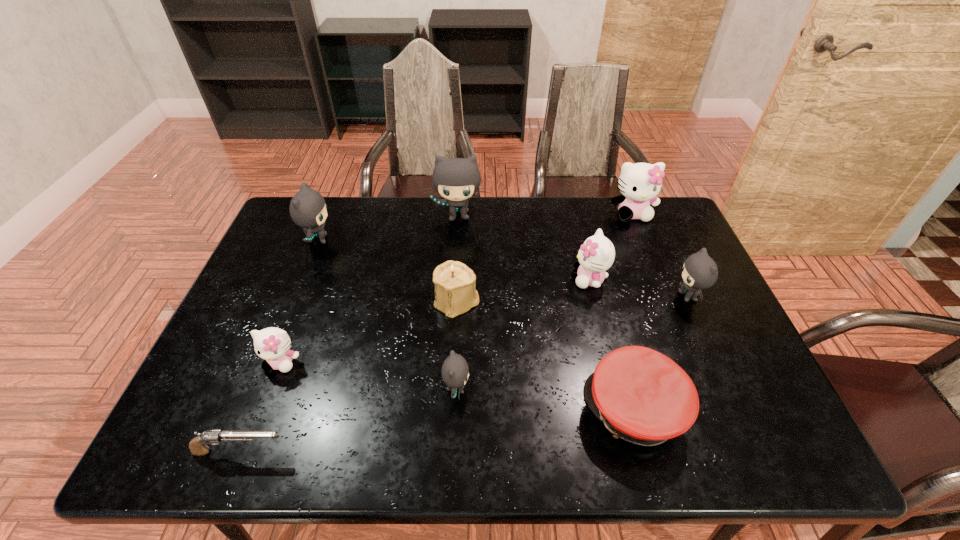
Identify the location of cap that is positioned at the near edge. (642, 396).

Image resolution: width=960 pixels, height=540 pixels. I want to click on gun situated at the near edge, so click(198, 446).

The width and height of the screenshot is (960, 540). What are the coordinates of `gun that is positioned at the left edge` in the screenshot? It's located at (198, 446).

You are a GUI agent. You are given a task and a screenshot of the screen. Output one action in this format:
    pyautogui.click(x=<x>, y=<y>)
    Task: Click on the object that is at the far left corner
    The width and height of the screenshot is (960, 540).
    Given the screenshot: What is the action you would take?
    pyautogui.click(x=308, y=209)

Find the location of a particular element. The height and width of the screenshot is (540, 960). object that is at the near left corner is located at coordinates (198, 446).

Image resolution: width=960 pixels, height=540 pixels. In order to click on object that is at the far right corner in this screenshot , I will do `click(639, 183)`.

Identify the location of vacant area at the far edge of the desktop. (335, 212).

I want to click on vacant space at the near edge, so click(x=284, y=442).

Where is `free spot at the left edge of the desktop`? This screenshot has width=960, height=540. free spot at the left edge of the desktop is located at coordinates (307, 253).

Where is `vacant space at the right edge`? The height and width of the screenshot is (540, 960). vacant space at the right edge is located at coordinates (674, 331).